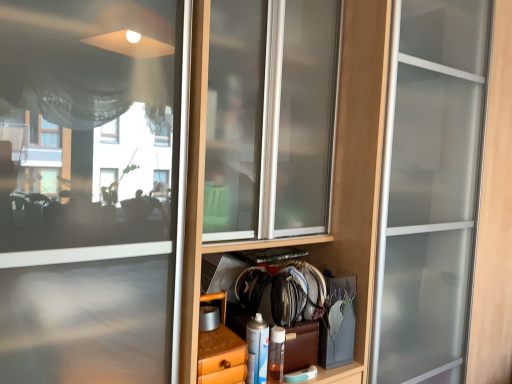
Question: Should I look upward or downward to see translucent plastic spray can at lower center?

Choices:
 (A) down
 (B) up

Answer: (A)

Question: Is translucent plastic spray can at lower center in front of wooden drawer at lower center?

Choices:
 (A) no
 (B) yes

Answer: (A)

Question: From a real-world perspective, is translucent plastic spray can at lower center over wooden drawer at lower center?

Choices:
 (A) no
 (B) yes

Answer: (A)

Question: Can you confirm if translucent plastic spray can at lower center is positioned to the left of wooden drawer at lower center?

Choices:
 (A) yes
 (B) no

Answer: (B)

Question: From the image's perspective, is translucent plastic spray can at lower center on wooden drawer at lower center?

Choices:
 (A) no
 (B) yes

Answer: (A)

Question: Is translucent plastic spray can at lower center aimed at wooden drawer at lower center?

Choices:
 (A) no
 (B) yes

Answer: (A)

Question: Is translucent plastic spray can at lower center wider than wooden drawer at lower center?

Choices:
 (A) no
 (B) yes

Answer: (A)

Question: Does wooden drawer at lower center appear on the left side of translucent plastic spray can at lower center?

Choices:
 (A) no
 (B) yes

Answer: (B)

Question: Is wooden drawer at lower center turned away from translucent plastic spray can at lower center?

Choices:
 (A) yes
 (B) no

Answer: (B)

Question: Is wooden drawer at lower center facing towards translucent plastic spray can at lower center?

Choices:
 (A) no
 (B) yes

Answer: (A)

Question: Could translucent plastic spray can at lower center be considered to be inside wooden drawer at lower center?

Choices:
 (A) yes
 (B) no

Answer: (B)

Question: Does wooden drawer at lower center appear on the right side of translucent plastic spray can at lower center?

Choices:
 (A) yes
 (B) no

Answer: (B)

Question: From the image's perspective, is wooden drawer at lower center below translucent plastic spray can at lower center?

Choices:
 (A) yes
 (B) no

Answer: (B)

Question: Does point (243, 380) appear closer or farther from the camera than point (266, 362)?

Choices:
 (A) closer
 (B) farther

Answer: (A)